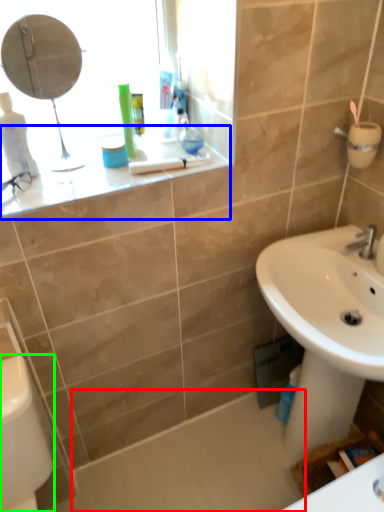
Question: Which object is the closest to the bath (highlighted by a red box)? Choose among these: counter top (highlighted by a blue box) or porcelain (highlighted by a green box).

Choices:
 (A) counter top
 (B) porcelain

Answer: (B)